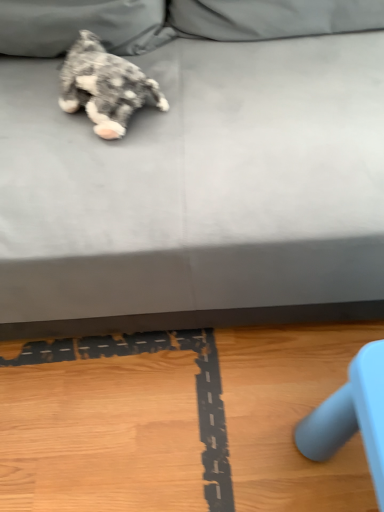
Question: From the image's perspective, is gray fabric couch at upper center located above or below fluffy gray dog at upper left?

Choices:
 (A) below
 (B) above

Answer: (B)

Question: Is gray fabric couch at upper center inside or outside of fluffy gray dog at upper left?

Choices:
 (A) inside
 (B) outside

Answer: (B)

Question: Is gray fabric couch at upper center to the left or to the right of fluffy gray dog at upper left in the image?

Choices:
 (A) right
 (B) left

Answer: (A)

Question: In the image, is fluffy gray dog at upper left on the left side or the right side of gray fabric couch at upper center?

Choices:
 (A) left
 (B) right

Answer: (A)

Question: From their relative heights in the image, would you say fluffy gray dog at upper left is taller or shorter than gray fabric couch at upper center?

Choices:
 (A) tall
 (B) short

Answer: (B)

Question: From a real-world perspective, is fluffy gray dog at upper left above or below gray fabric couch at upper center?

Choices:
 (A) below
 (B) above

Answer: (B)

Question: From the image's perspective, is fluffy gray dog at upper left located above or below gray fabric couch at upper center?

Choices:
 (A) below
 (B) above

Answer: (A)